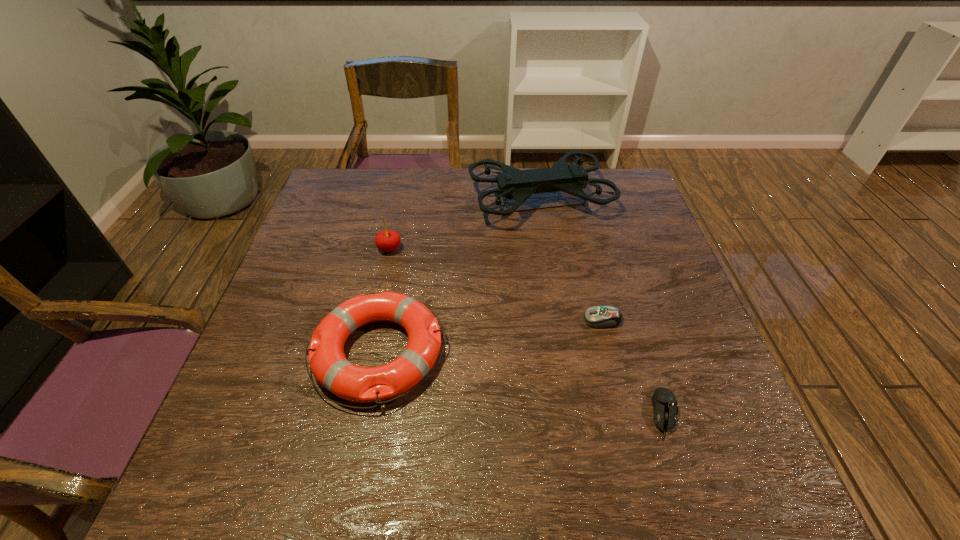
The width and height of the screenshot is (960, 540). What are the coordinates of `vacant space at the far edge` in the screenshot? It's located at click(420, 200).

In the image, there is a desktop. Find the location of `vacant space at the near edge`. vacant space at the near edge is located at coordinates (506, 463).

Where is `blank space at the left edge of the desktop`? blank space at the left edge of the desktop is located at coordinates (260, 397).

At what (x,y) coordinates should I click in order to perform the action: click on free space at the right edge of the desktop. Please return your answer as a coordinate pair (x, y). This screenshot has width=960, height=540. Looking at the image, I should click on (684, 405).

Where is `vacant point at the far left corner`? The width and height of the screenshot is (960, 540). vacant point at the far left corner is located at coordinates (378, 172).

The width and height of the screenshot is (960, 540). In the image, there is a desktop. What are the coordinates of `vacant space at the near left corner` in the screenshot? It's located at (259, 478).

Where is `free space at the far right corner`? The height and width of the screenshot is (540, 960). free space at the far right corner is located at coordinates (588, 186).

Where is `unoccupied position between the left computer mouse and the third shortest object`? Image resolution: width=960 pixels, height=540 pixels. unoccupied position between the left computer mouse and the third shortest object is located at coordinates (491, 336).

I want to click on free space between the fourth shortest object and the nearer computer mouse, so click(527, 332).

You are a GUI agent. You are given a task and a screenshot of the screen. Output one action in this format:
    pyautogui.click(x=<x>, y=<y>)
    Task: Click on the vacant region between the life buoy and the farther computer mouse
    The image size is (960, 540).
    Given the screenshot: What is the action you would take?
    pyautogui.click(x=491, y=336)